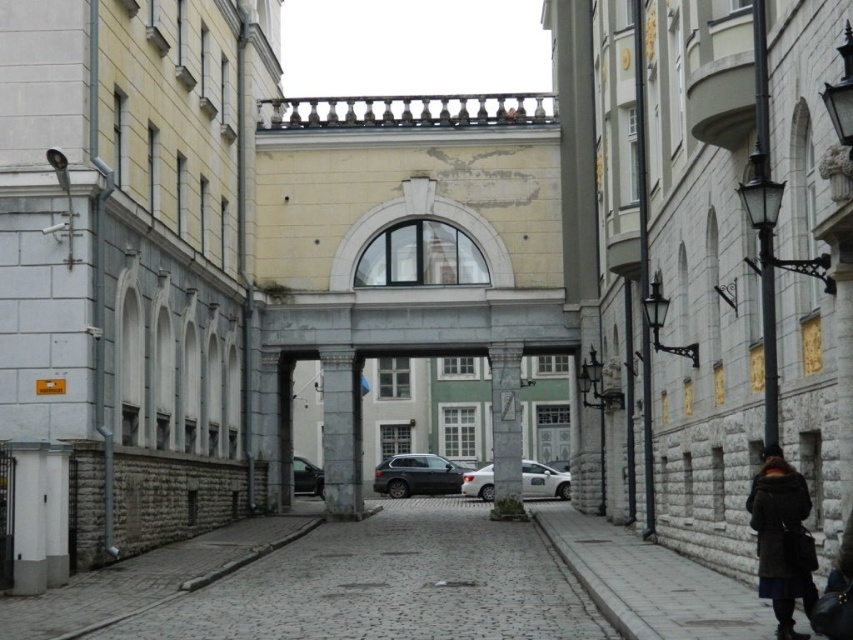
You are a delivery person who needs to place a large package on the sidewalk next to the white metallic car at center. However, there is a dark brown wool coat at lower right in the way. Based on the scene, can you move the coat to the left to make space?

The dark brown wool coat at lower right is positioned on the right side of the white metallic car at center. Moving it to the left would place it closer to the car, which may not provide enough space for the package. Alternatively, moving it further to the left away from the car might be necessary, but the scene description does not specify the exact dimensions or available space beyond the objects mentioned.

You are a delivery person standing at the entrance of the street. You need to place a dark brown wool coat at lower right and a white metallic car at center in such a way that they are exactly 94.35 meters apart. Given that the street is only 100 meters long, can you position them within the street without exceeding its length?

The dark brown wool coat at lower right and white metallic car at center are already 94.35 meters apart, which is within the 100 meter length of the street. Therefore, they can be positioned within the street without exceeding its length.

You are a delivery person carrying a large package that requires you to walk through the narrow street. You see a dark brown wool coat at lower right and a matte black suv at center. Which object should you avoid to ensure your package doesn

The dark brown wool coat at lower right has a smaller size compared to matte black suv at center, so you should avoid the matte black suv at center as it is larger and may obstruct your path with the large package.